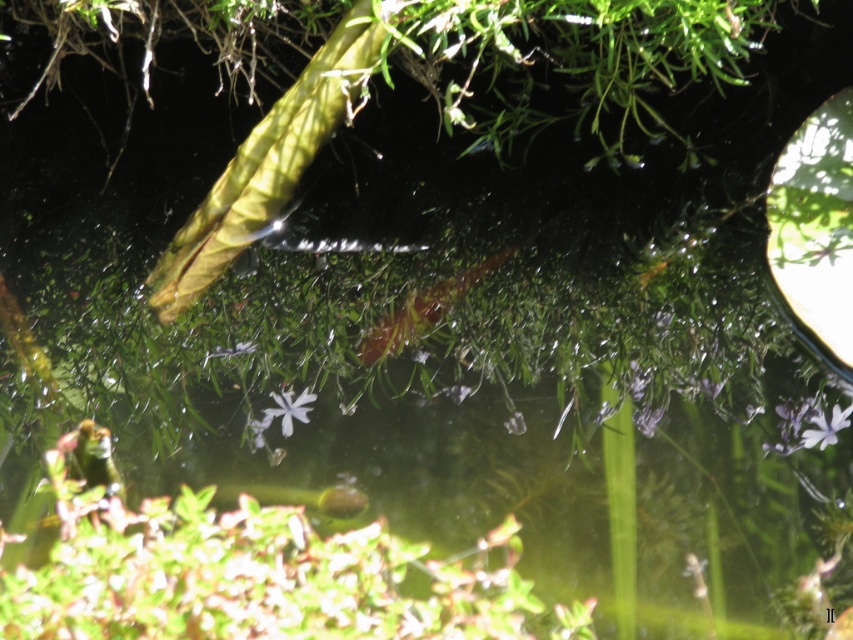
Which of these two, purple matte flower at center-right or white matte flower at center, stands taller?

white matte flower at center

Does purple matte flower at center-right appear on the right side of white matte flower at center?

Correct, you'll find purple matte flower at center-right to the right of white matte flower at center.

Describe the element at coordinates (825, 426) in the screenshot. I see `purple matte flower at center-right` at that location.

Where is `purple matte flower at center-right`? The height and width of the screenshot is (640, 853). purple matte flower at center-right is located at coordinates click(x=825, y=426).